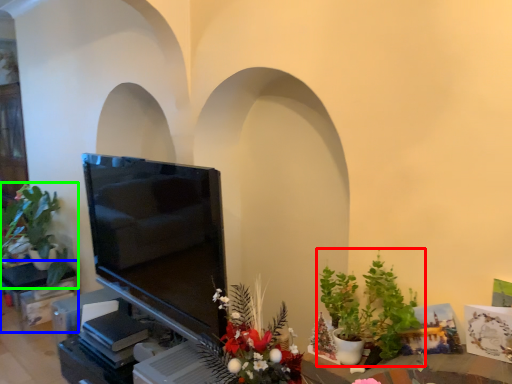
Question: Estimate the real-world distances between objects in this image. Which object is closer to houseplant (highlighted by a red box), furniture (highlighted by a blue box) or houseplant (highlighted by a green box)?

Choices:
 (A) furniture
 (B) houseplant

Answer: (B)